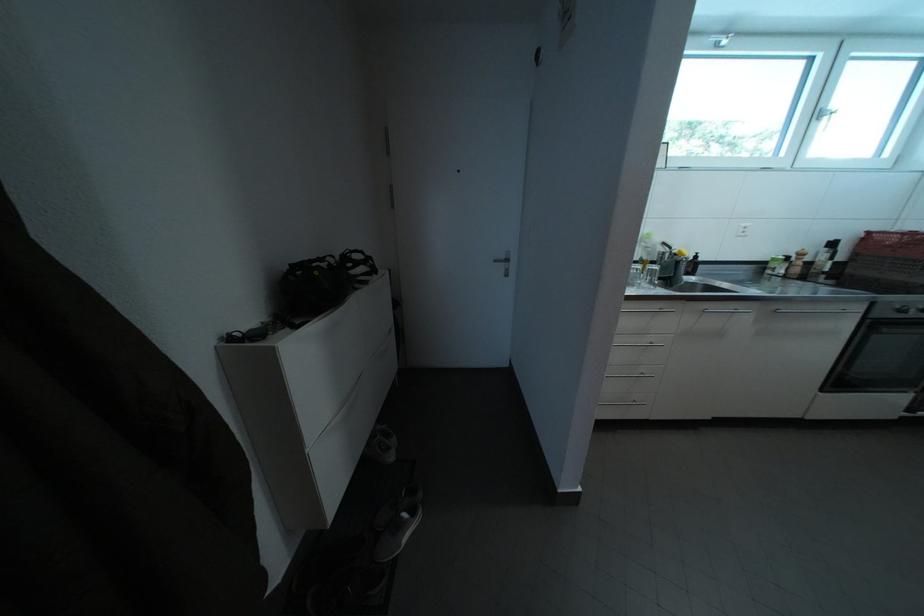
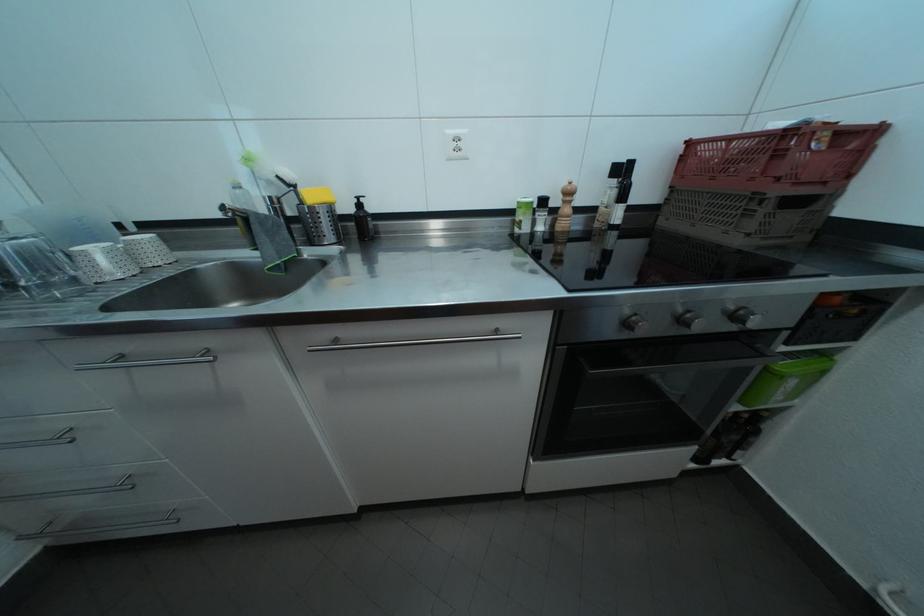
What movement of the cameraman would produce the second image?

The movement direction of the cameraman is right, forward.